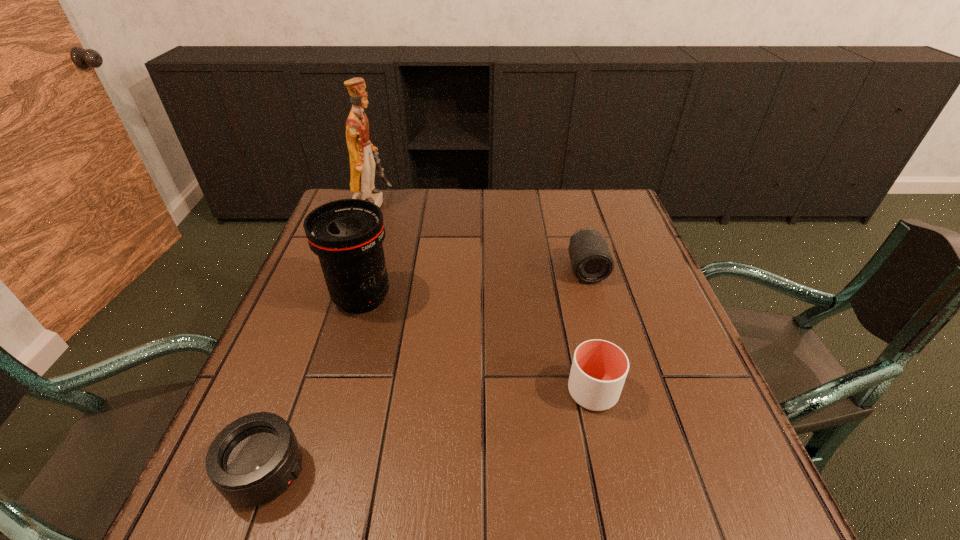
Find the location of `free spot between the nutcracker and the cup`. free spot between the nutcracker and the cup is located at coordinates (483, 297).

This screenshot has width=960, height=540. I want to click on unoccupied position between the tallest telephoto lens and the rightmost telephoto lens, so click(474, 284).

Find the location of a particular element. The height and width of the screenshot is (540, 960). free space between the fourth farthest object and the nearest telephoto lens is located at coordinates (430, 432).

Choose which object is the fourth nearest neighbor to the farthest object. Please provide its 2D coordinates. Your answer should be formatted as a tuple, i.e. [(x, y)], where the tuple contains the x and y coordinates of a point satisfying the conditions above.

[(599, 368)]

Select which object is the closest to the rightmost telephoto lens. Please provide its 2D coordinates. Your answer should be formatted as a tuple, i.e. [(x, y)], where the tuple contains the x and y coordinates of a point satisfying the conditions above.

[(599, 368)]

Find the location of a particular element. telephoto lens that is the second closest to the shortest object is located at coordinates click(x=591, y=260).

Locate which telephoto lens ranks second in proximity to the fourth shortest object. Please provide its 2D coordinates. Your answer should be formatted as a tuple, i.e. [(x, y)], where the tuple contains the x and y coordinates of a point satisfying the conditions above.

[(591, 260)]

This screenshot has height=540, width=960. Identify the location of vacant region that satisfies the following two spatial constraints: 1. on the surface of the rightmost telephoto lens; 2. on the side of the shortest telephoto lens with brand markings and control switches. (643, 472).

Locate an element on the screen. This screenshot has width=960, height=540. vacant point that satisfies the following two spatial constraints: 1. on the back side of the second nearest object; 2. on the front-facing side of the tallest object is located at coordinates (550, 202).

This screenshot has width=960, height=540. Identify the location of blank area in the image that satisfies the following two spatial constraints: 1. on the front-facing side of the nutcracker; 2. on the right side of the fourth farthest object. (306, 392).